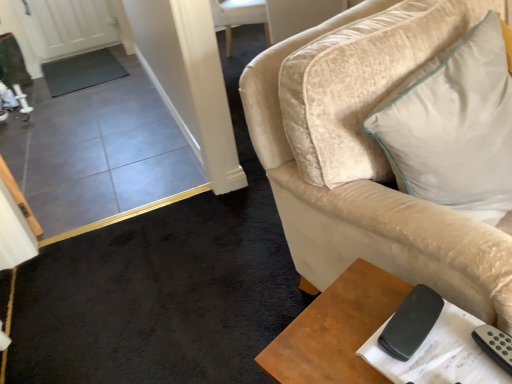
Find the location of `vacant area on the back side of black matte remote at lower right`. vacant area on the back side of black matte remote at lower right is located at coordinates (374, 289).